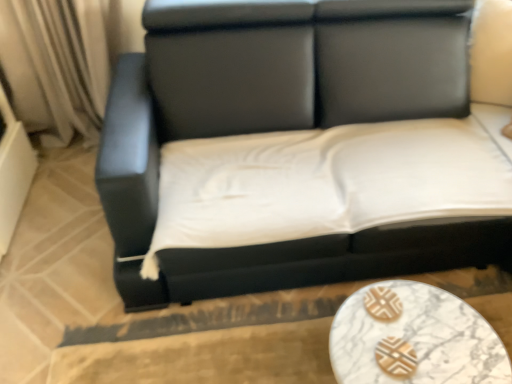
Question: Considering their positions, is white marble table at lower center located in front of or behind black leather couch at center?

Choices:
 (A) front
 (B) behind

Answer: (B)

Question: From the image's perspective, relative to black leather couch at center, is white marble table at lower center above or below?

Choices:
 (A) above
 (B) below

Answer: (B)

Question: Would you say white marble table at lower center is inside or outside black leather couch at center?

Choices:
 (A) inside
 (B) outside

Answer: (B)

Question: In terms of height, does black leather couch at center look taller or shorter compared to white marble table at lower center?

Choices:
 (A) tall
 (B) short

Answer: (A)

Question: In the image, is black leather couch at center positioned in front of or behind white marble table at lower center?

Choices:
 (A) behind
 (B) front

Answer: (B)

Question: Is black leather couch at center wider or thinner than white marble table at lower center?

Choices:
 (A) thin
 (B) wide

Answer: (B)

Question: From a real-world perspective, is black leather couch at center physically located above or below white marble table at lower center?

Choices:
 (A) above
 (B) below

Answer: (A)